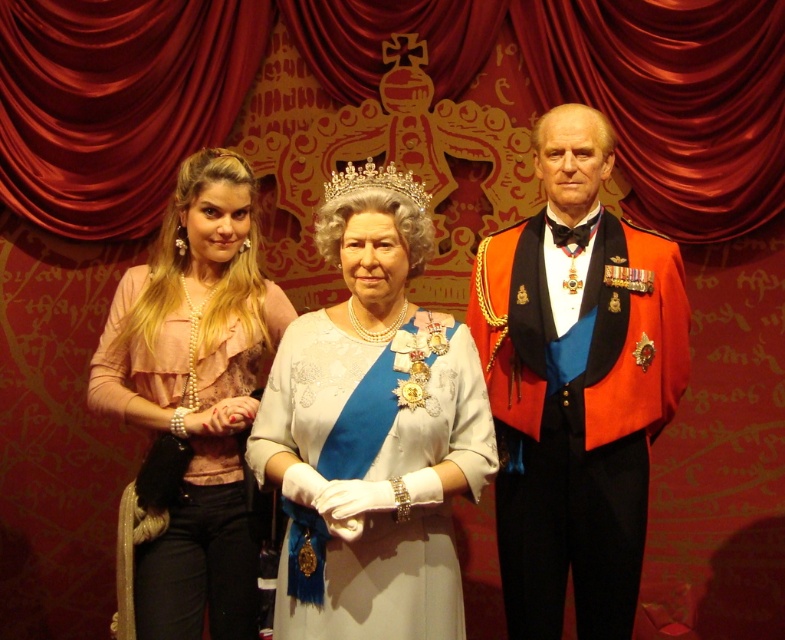
Which of these two, red velvet curtain at center or matte white wax figure at center, stands taller?

Standing taller between the two is matte white wax figure at center.

Which of these two, red velvet curtain at center or matte white wax figure at center, stands shorter?

red velvet curtain at center

Who is more forward, (466, 70) or (685, 353)?

Point (685, 353) is in front.

This screenshot has height=640, width=785. Find the location of `red velvet curtain at center`. red velvet curtain at center is located at coordinates (378, 90).

Based on the photo, between matte white wax figure at center and white satin dress at center, which one appears on the left side from the viewer's perspective?

white satin dress at center is more to the left.

Which is above, matte white wax figure at center or white satin dress at center?

matte white wax figure at center is higher up.

Where is `matte white wax figure at center`? This screenshot has height=640, width=785. matte white wax figure at center is located at coordinates [575, 384].

Locate an element on the screen. This screenshot has height=640, width=785. matte white wax figure at center is located at coordinates (575, 384).

Can you confirm if matte white wax figure at center is positioned below pearl necklace at left?

No.

The width and height of the screenshot is (785, 640). What are the coordinates of `matte white wax figure at center` in the screenshot? It's located at (x=575, y=384).

Find the location of a particular element. Image resolution: width=785 pixels, height=640 pixels. matte white wax figure at center is located at coordinates (575, 384).